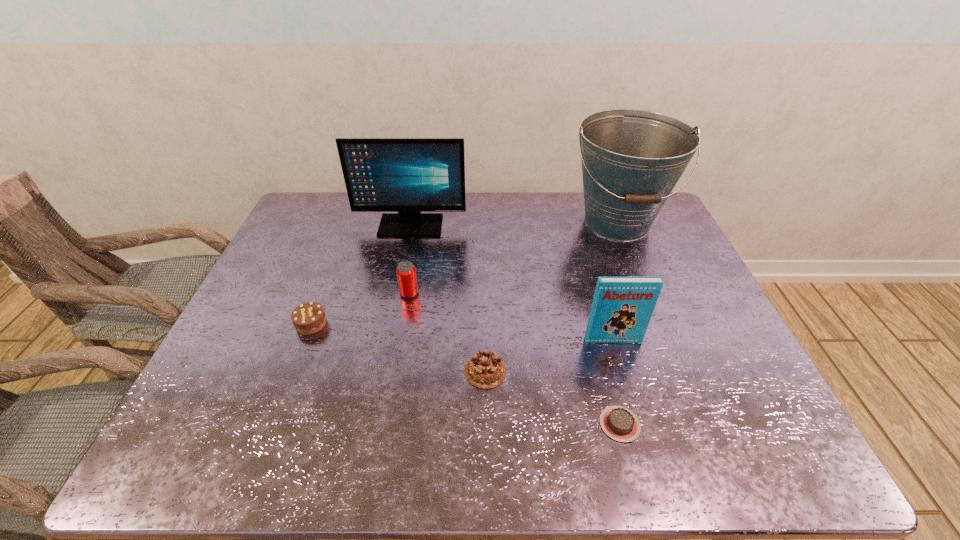
Locate an element on the screen. The height and width of the screenshot is (540, 960). bucket is located at coordinates (632, 159).

The width and height of the screenshot is (960, 540). I want to click on monitor, so click(406, 175).

This screenshot has height=540, width=960. In order to click on the third nearest object in this screenshot , I will do `click(622, 307)`.

Locate an element on the screen. The height and width of the screenshot is (540, 960). the third tallest object is located at coordinates (622, 307).

This screenshot has width=960, height=540. I want to click on the fifth nearest object, so click(x=406, y=272).

This screenshot has height=540, width=960. What are the coordinates of `the fourth shortest object` in the screenshot? It's located at (406, 272).

Where is `the farthest chocolate cake`? The image size is (960, 540). the farthest chocolate cake is located at coordinates (308, 318).

Image resolution: width=960 pixels, height=540 pixels. Identify the location of the leftmost chocolate cake. (308, 318).

You are a GUI agent. You are given a task and a screenshot of the screen. Output one action in this format:
    pyautogui.click(x=<x>, y=<y>)
    Task: Click on the sixth tallest object
    Image resolution: width=960 pixels, height=540 pixels.
    Given the screenshot: What is the action you would take?
    pyautogui.click(x=485, y=369)

At what (x,y) coordinates should I click in order to perform the action: click on the second farthest chocolate cake. Please return your answer as a coordinate pair (x, y). This screenshot has height=540, width=960. Looking at the image, I should click on (485, 369).